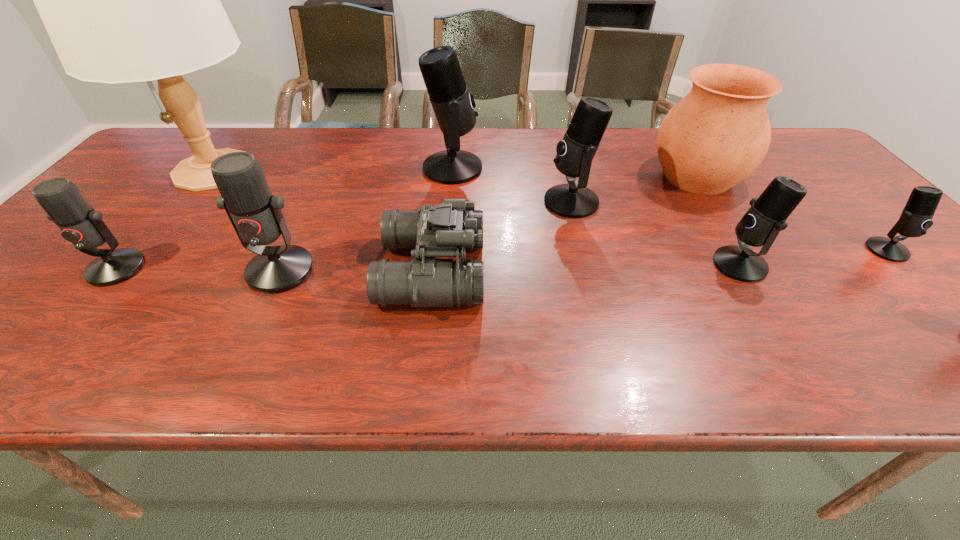
The width and height of the screenshot is (960, 540). I want to click on vacant area that lies between the binoculars and the rightmost black microphone, so click(660, 260).

Where is `free space between the smallest black microphone and the second tallest object`? This screenshot has width=960, height=540. free space between the smallest black microphone and the second tallest object is located at coordinates (670, 209).

Identify the location of free space between the leftmost black microphone and the third smallest black microphone. The width and height of the screenshot is (960, 540). (512, 185).

The image size is (960, 540). I want to click on free space between the third black microphone from left to right and the second farthest microphone, so click(x=656, y=233).

Where is `vacant area that lies between the right red microphone and the pottery`? Image resolution: width=960 pixels, height=540 pixels. vacant area that lies between the right red microphone and the pottery is located at coordinates (489, 224).

Where is `vacant space that's between the shortest microphone and the fifth microphone from left to right`? This screenshot has height=540, width=960. vacant space that's between the shortest microphone and the fifth microphone from left to right is located at coordinates (813, 257).

Identify which object is the seventh closest to the shortest microphone. Please provide its 2D coordinates. Your answer should be formatted as a tuple, i.e. [(x, y)], where the tuple contains the x and y coordinates of a point satisfying the conditions above.

[(123, 0)]

Point out which object is positioned as the second nearest to the smallest black microphone. Please provide its 2D coordinates. Your answer should be formatted as a tuple, i.e. [(x, y)], where the tuple contains the x and y coordinates of a point satisfying the conditions above.

[(761, 224)]

At what (x,y) coordinates should I click in order to perform the action: click on microphone identified as the second closest to the second biggest black microphone. Please return your answer as a coordinate pair (x, y). Looking at the image, I should click on (761, 224).

At what (x,y) coordinates should I click in order to perform the action: click on microphone that stands as the fifth closest to the blue binoculars. Please return your answer as a coordinate pair (x, y). The image size is (960, 540). Looking at the image, I should click on (65, 205).